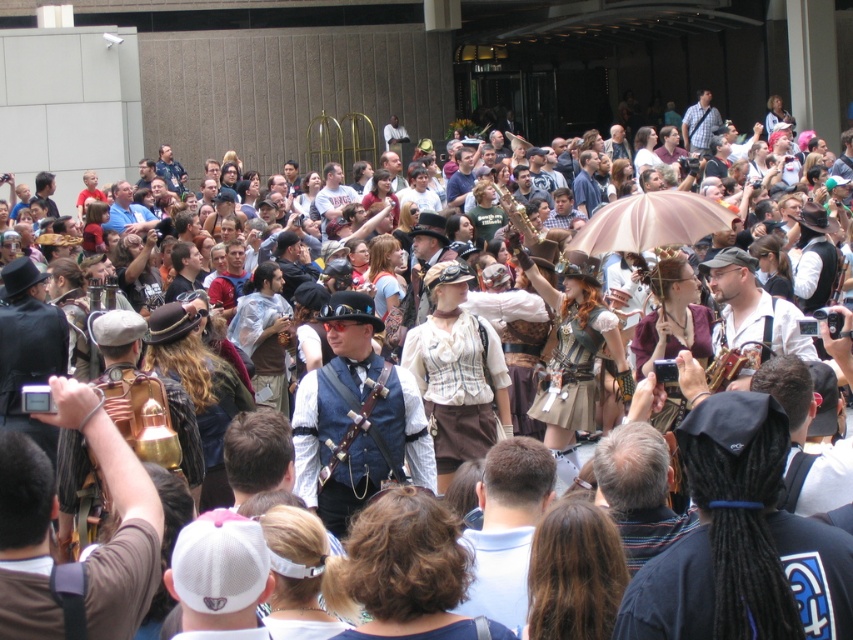
Question: Is black fabric dreadlocks at center below pink fabric umbrella at upper center?

Choices:
 (A) yes
 (B) no

Answer: (A)

Question: Where is pink fabric umbrella at upper center located in relation to plaid shirt at upper center in the image?

Choices:
 (A) right
 (B) left

Answer: (B)

Question: Can you confirm if black fabric dreadlocks at center is positioned to the right of matte black hat at upper center?

Choices:
 (A) no
 (B) yes

Answer: (B)

Question: Considering the real-world distances, which object is farthest from the matte black hat at upper center?

Choices:
 (A) light blue fabric shirt at center
 (B) copper brass instrument at center

Answer: (A)

Question: Which point is farther from the camera taking this photo?

Choices:
 (A) (596, 161)
 (B) (492, 504)

Answer: (A)

Question: Among these points, which one is nearest to the camera?

Choices:
 (A) click(167, 164)
 (B) click(648, 200)
 (C) click(579, 152)

Answer: (B)